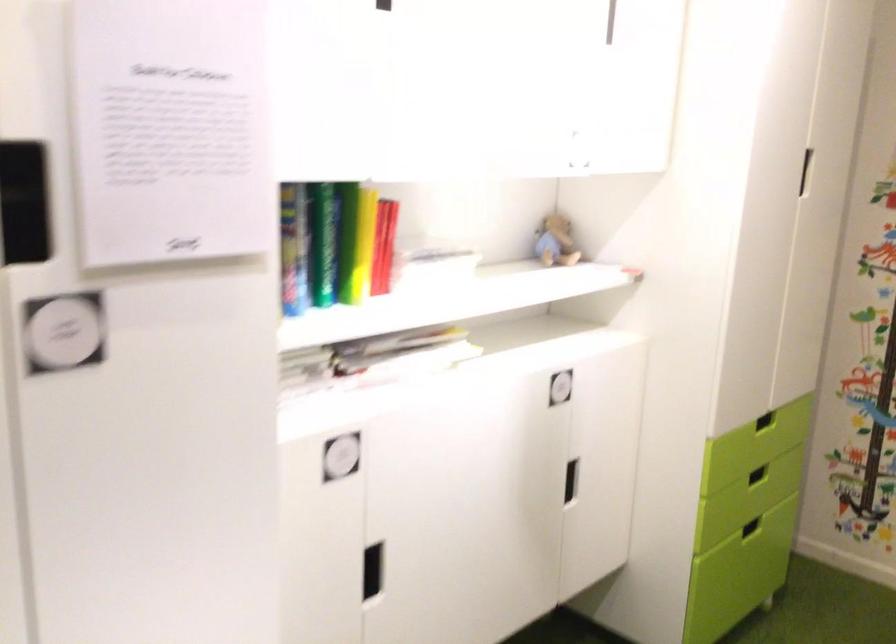
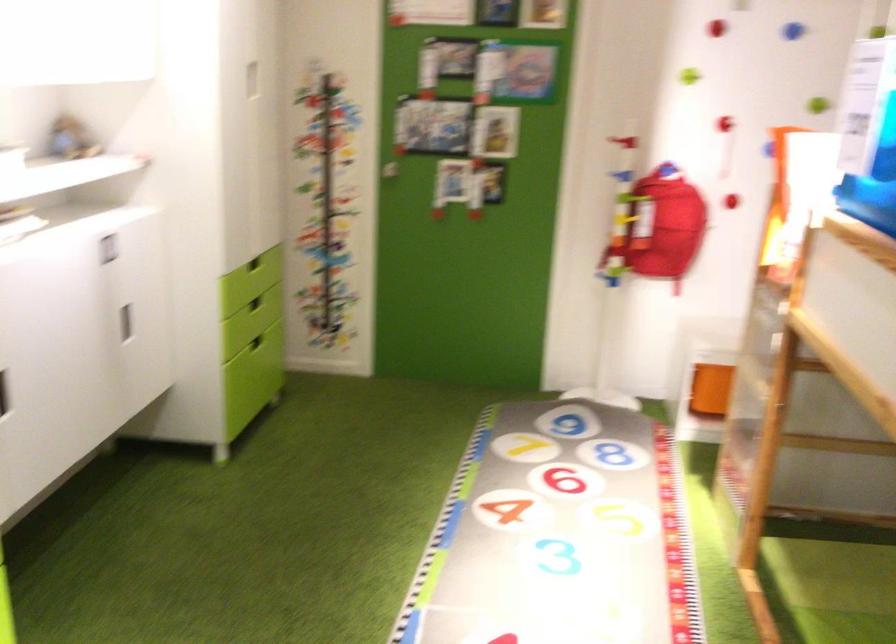
The point at (339, 572) is marked in the first image. Where is the corresponding point in the second image?

(3, 393)